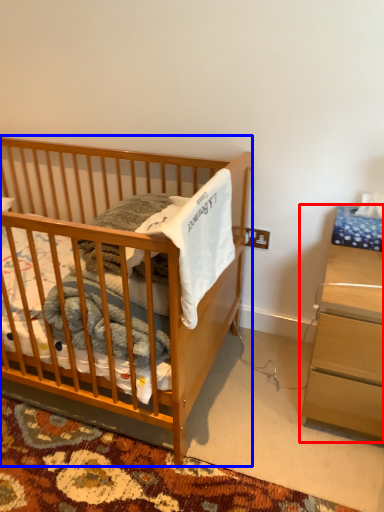
Question: Which of the following is the closest to the observer, nightstand (highlighted by a red box) or infant bed (highlighted by a blue box)?

Choices:
 (A) nightstand
 (B) infant bed

Answer: (B)